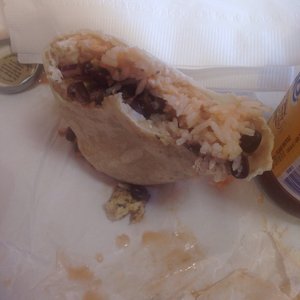
You are a GUI agent. You are given a task and a screenshot of the screen. Output one action in this format:
    pyautogui.click(x=<x>, y=<y>)
    Task: Click on the napkin
    
    Given the screenshot: What is the action you would take?
    pyautogui.click(x=242, y=19)